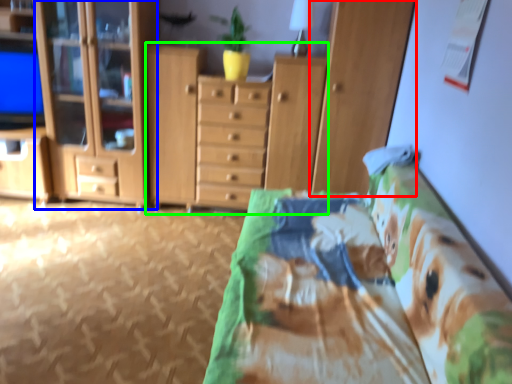
Question: Which object is the farthest from cabinetry (highlighted by a red box)? Choose among these: cabinetry (highlighted by a blue box) or cupboard (highlighted by a green box).

Choices:
 (A) cabinetry
 (B) cupboard

Answer: (A)